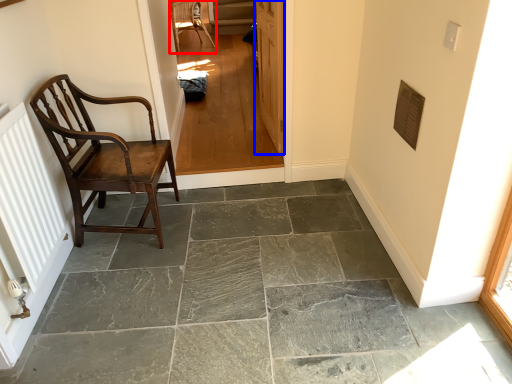
Question: Which object appears farthest to the camera in this image, chair (highlighted by a red box) or door (highlighted by a blue box)?

Choices:
 (A) chair
 (B) door

Answer: (A)